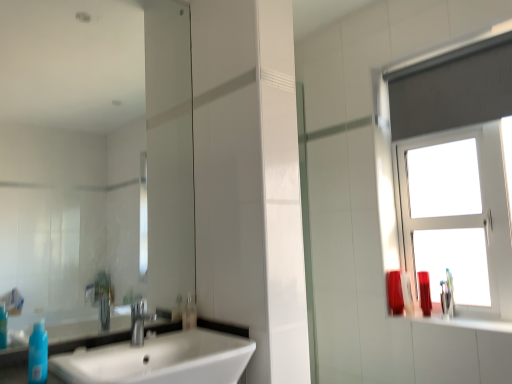
Question: In the image, is blue matte bottle at lower left positioned in front of or behind white glossy sink at lower left?

Choices:
 (A) behind
 (B) front

Answer: (A)

Question: In the image, is blue matte bottle at lower left on the left side or the right side of white glossy sink at lower left?

Choices:
 (A) right
 (B) left

Answer: (B)

Question: Which is nearer to the white glossy sink at lower left?

Choices:
 (A) matte plastic container at right, which is the third toiletry in front-to-back order
 (B) clear glass mirror at center
 (C) white glass window at upper right
 (D) blue matte bottle at lower left
 (E) shiny plastic bottle at right, which is the 4th toiletry in left-to-right order

Answer: (D)

Question: Estimate the real-world distances between objects in this image. Which object is farther from the white glass window at upper right?

Choices:
 (A) matte red vase at right, the third toiletry in the right-to-left sequence
 (B) silver metallic faucet at center
 (C) white glossy sink at lower left
 (D) shiny plastic bottle at right, which is the 4th toiletry in left-to-right order
 (E) clear plastic bottle at center, which is counted as the 1th toiletry, starting from the front

Answer: (B)